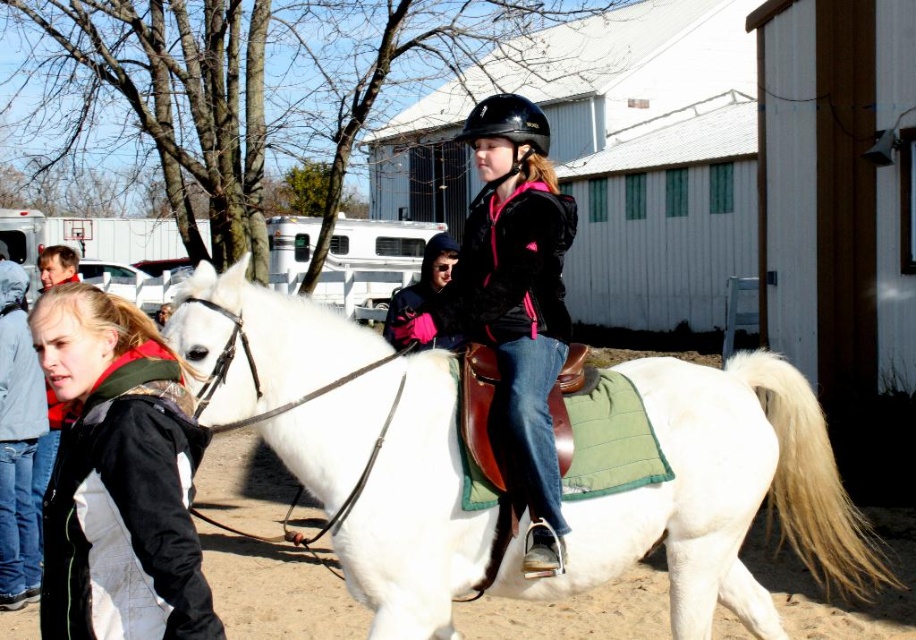
Question: Which is nearer to the black hard helmet at center?

Choices:
 (A) white matte/suede horse at center
 (B) black fleece jacket at lower left
 (C) matte black helmet at center

Answer: (C)

Question: Where is white matte/suede horse at center located in relation to black hard helmet at center in the image?

Choices:
 (A) right
 (B) left

Answer: (A)

Question: Does white matte/suede horse at center have a larger size compared to matte black helmet at center?

Choices:
 (A) yes
 (B) no

Answer: (A)

Question: Which of these objects is positioned farthest from the black hard helmet at center?

Choices:
 (A) black fleece jacket at lower left
 (B) white matte/suede horse at center

Answer: (A)

Question: Is matte black helmet at center to the left of black hard helmet at center from the viewer's perspective?

Choices:
 (A) no
 (B) yes

Answer: (B)

Question: Which of the following is the farthest from the observer?

Choices:
 (A) (557, 253)
 (B) (568, 522)
 (C) (515, 161)
 (D) (104, 317)

Answer: (C)